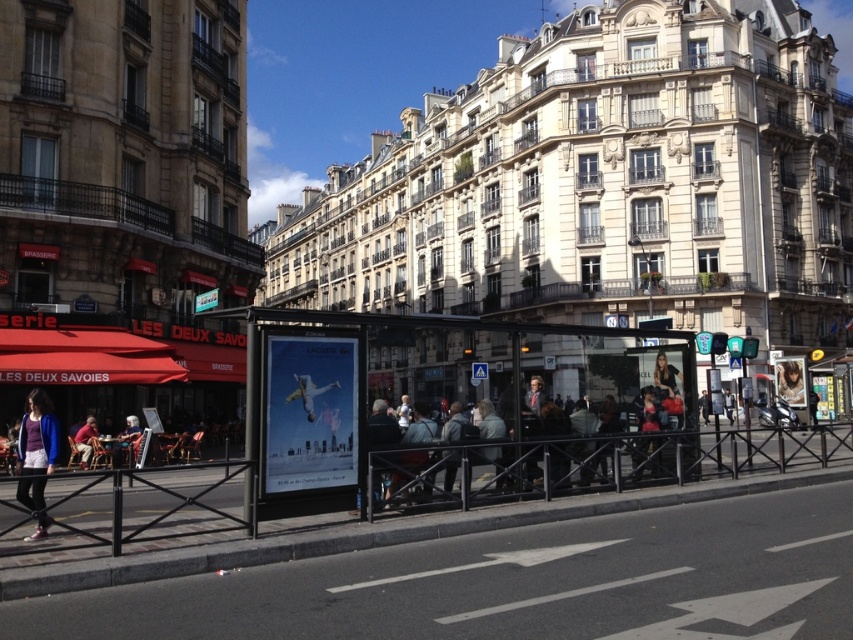
Does dark blue jeans at center have a greater width compared to metallic silver poster at center?

Yes, dark blue jeans at center is wider than metallic silver poster at center.

Can you confirm if dark blue jeans at center is positioned above metallic silver poster at center?

Correct, dark blue jeans at center is located above metallic silver poster at center.

Is point (387, 419) more distant than point (785, 356)?

No.

In order to click on dark blue jeans at center in this screenshot , I will do `click(381, 428)`.

Describe the element at coordinates (38, 435) in the screenshot. This screenshot has height=640, width=853. I see `matte blue sweater at lower left` at that location.

Between matte blue sweater at lower left and metallic silver poster at center, which one is positioned lower?

Positioned lower is metallic silver poster at center.

You are a GUI agent. You are given a task and a screenshot of the screen. Output one action in this format:
    pyautogui.click(x=<x>, y=<y>)
    Task: Click on the matte blue sweater at lower left
    The width and height of the screenshot is (853, 640).
    Given the screenshot: What is the action you would take?
    pyautogui.click(x=38, y=435)

Can you confirm if transparent glass bus stop at center is bigger than matte black jacket at center?

Yes.

From the picture: Who is shorter, transparent glass bus stop at center or matte black jacket at center?

matte black jacket at center is shorter.

Who is more distant from viewer, [357,336] or [445,452]?

The point [445,452] is behind.

Where is `transparent glass bus stop at center`? The width and height of the screenshot is (853, 640). transparent glass bus stop at center is located at coordinates (445, 397).